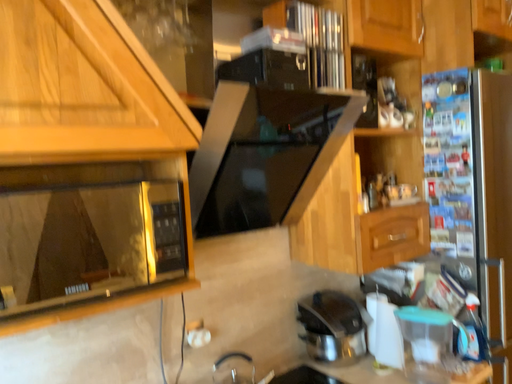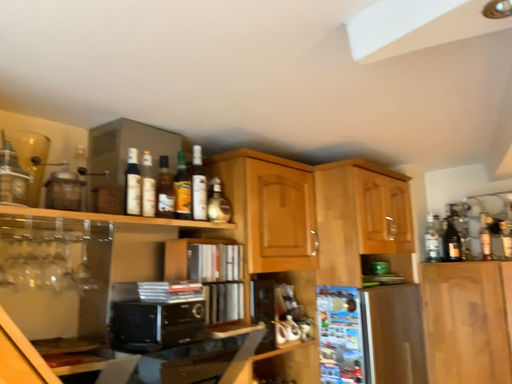
Question: Which way did the camera rotate in the video?

Choices:
 (A) rotated right
 (B) rotated left

Answer: (A)